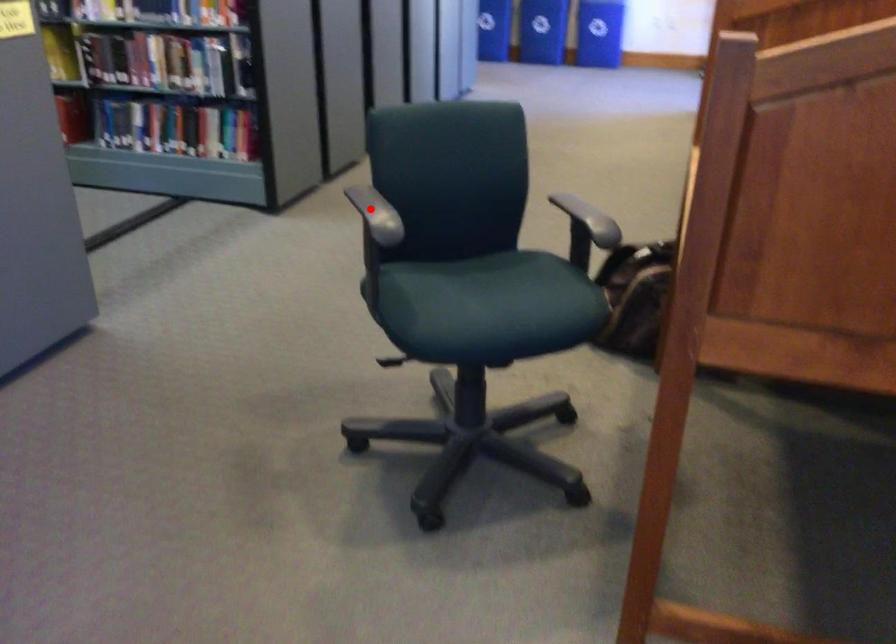
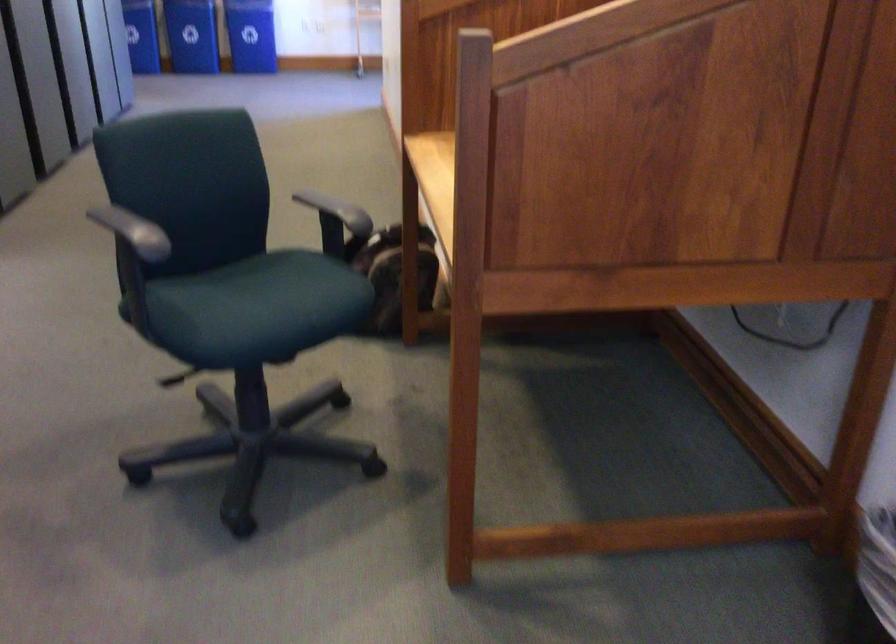
Find the pixel in the second image that matches the highlighted location in the first image.

(134, 227)